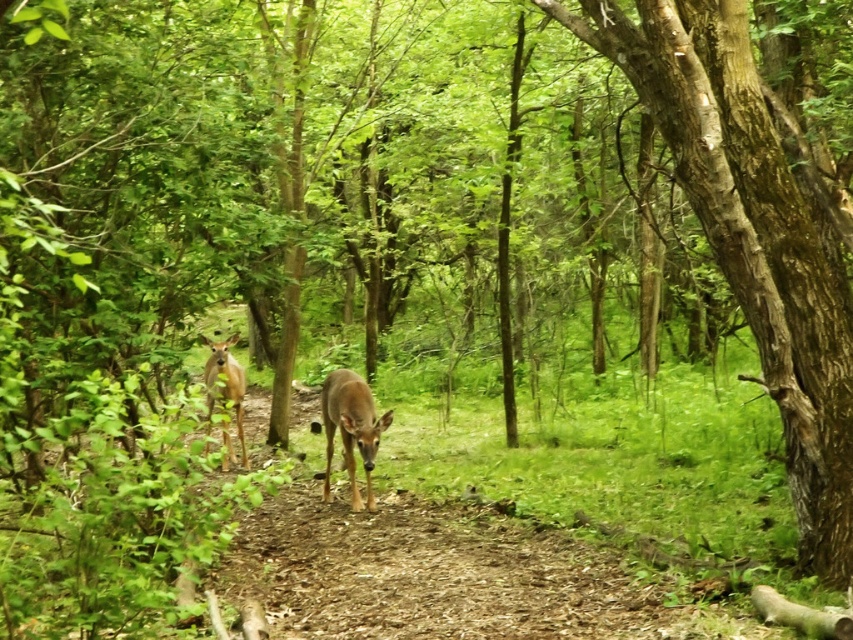
Is point (740, 157) closer to viewer compared to point (227, 384)?

Yes.

Identify the location of smooth bark tree at center. This screenshot has height=640, width=853. (749, 234).

Identify the location of smooth bark tree at center. (749, 234).

Who is lower down, smooth bark tree at center or brown matte deer at center?

brown matte deer at center

Can you confirm if smooth bark tree at center is thinner than brown matte deer at center?

No, smooth bark tree at center is not thinner than brown matte deer at center.

At what (x,y) coordinates should I click in order to perform the action: click on smooth bark tree at center. Please return your answer as a coordinate pair (x, y). Image resolution: width=853 pixels, height=640 pixels. Looking at the image, I should click on (749, 234).

Is brown matte deer at center above brown matte/deer at center?

Actually, brown matte deer at center is below brown matte/deer at center.

The width and height of the screenshot is (853, 640). Describe the element at coordinates (351, 428) in the screenshot. I see `brown matte deer at center` at that location.

This screenshot has width=853, height=640. Identify the location of brown matte deer at center. (351, 428).